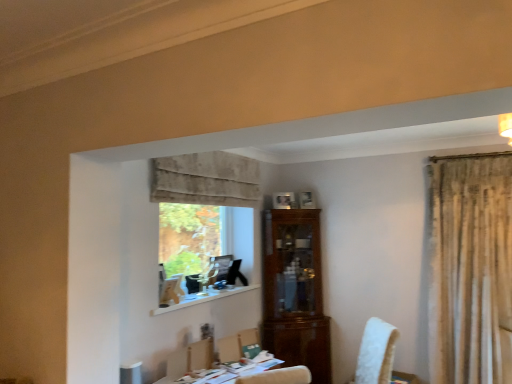
Question: Considering the positions of white wood at lower center and clear glass window at center in the image, is white wood at lower center bigger or smaller than clear glass window at center?

Choices:
 (A) big
 (B) small

Answer: (B)

Question: From the image's perspective, relative to clear glass window at center, is white wood at lower center above or below?

Choices:
 (A) above
 (B) below

Answer: (B)

Question: Which is farther from the beige velvet curtain at upper center?

Choices:
 (A) green fabric chair at center
 (B) white wood at lower center
 (C) white glossy table at lower center
 (D) light brown wooden armchair at lower center
 (E) clear glass window at center

Answer: (C)

Question: Which object is the closest to the white glossy table at lower center?

Choices:
 (A) clear glass window at center
 (B) light brown wooden armchair at lower center
 (C) beige velvet curtain at upper center
 (D) green fabric chair at center
 (E) white wood at lower center

Answer: (B)